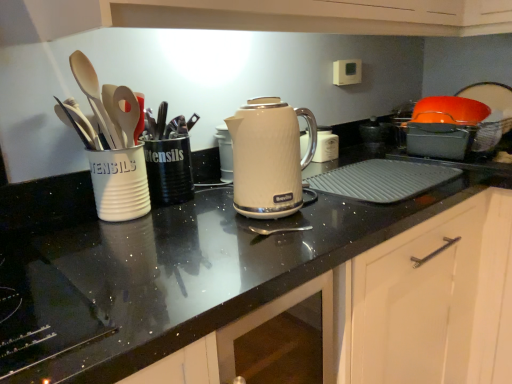
Question: Is white matte cabinet door at lower right, which is counted as the first cabinetry, starting from the right, positioned behind matte white kettle at center?

Choices:
 (A) no
 (B) yes

Answer: (B)

Question: Is white matte cabinet door at lower right, placed as the first cabinetry when sorted from back to front, next to matte white kettle at center?

Choices:
 (A) yes
 (B) no

Answer: (B)

Question: Is white matte cabinet door at lower right, placed as the first cabinetry when sorted from back to front, in front of matte white kettle at center?

Choices:
 (A) no
 (B) yes

Answer: (A)

Question: From the image's perspective, is white matte cabinet door at lower right, which is counted as the first cabinetry, starting from the right, under matte white kettle at center?

Choices:
 (A) yes
 (B) no

Answer: (A)

Question: Is white matte cabinet door at lower right, which is counted as the first cabinetry, starting from the right, positioned far away from matte white kettle at center?

Choices:
 (A) no
 (B) yes

Answer: (A)

Question: Visually, is white matte cabinet door at lower right, the 2th cabinetry positioned from the front, positioned to the left or to the right of black plastic utensils at center, which appears as the first tableware when viewed from the right?

Choices:
 (A) left
 (B) right

Answer: (B)

Question: Is white matte cabinet door at lower right, the 2th cabinetry positioned from the front, wider or thinner than black plastic utensils at center, which appears as the first tableware when viewed from the right?

Choices:
 (A) wide
 (B) thin

Answer: (A)

Question: Is point (439, 319) positioned closer to the camera than point (173, 182)?

Choices:
 (A) closer
 (B) farther

Answer: (B)

Question: Is white matte cabinet door at lower right, the 2th cabinetry when ordered from left to right, taller or shorter than black plastic utensils at center, which appears as the first tableware when viewed from the right?

Choices:
 (A) short
 (B) tall

Answer: (B)

Question: Considering the positions of white glossy electric kettle at center and matte white kettle at center in the image, is white glossy electric kettle at center bigger or smaller than matte white kettle at center?

Choices:
 (A) small
 (B) big

Answer: (A)

Question: In the image, is white glossy electric kettle at center positioned in front of or behind matte white kettle at center?

Choices:
 (A) front
 (B) behind

Answer: (B)

Question: In terms of width, does white glossy electric kettle at center look wider or thinner when compared to matte white kettle at center?

Choices:
 (A) wide
 (B) thin

Answer: (B)

Question: Is white glossy electric kettle at center to the left or to the right of matte white kettle at center in the image?

Choices:
 (A) left
 (B) right

Answer: (B)

Question: Is matte white kettle at center taller or shorter than white glossy electric kettle at center?

Choices:
 (A) short
 (B) tall

Answer: (B)

Question: Is matte white kettle at center situated inside white glossy electric kettle at center or outside?

Choices:
 (A) inside
 (B) outside

Answer: (B)